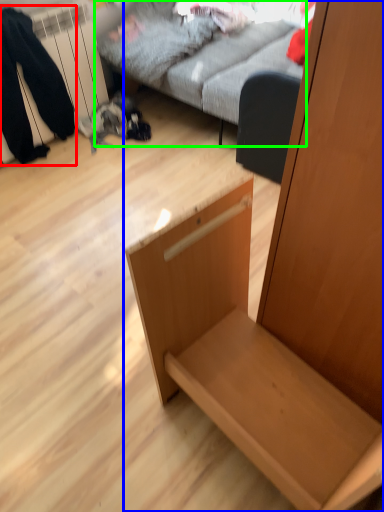
Question: Which object is positioned closest to couple (highlighted by a red box)? Select from furniture (highlighted by a blue box) and studio couch (highlighted by a green box).

Choices:
 (A) furniture
 (B) studio couch

Answer: (B)